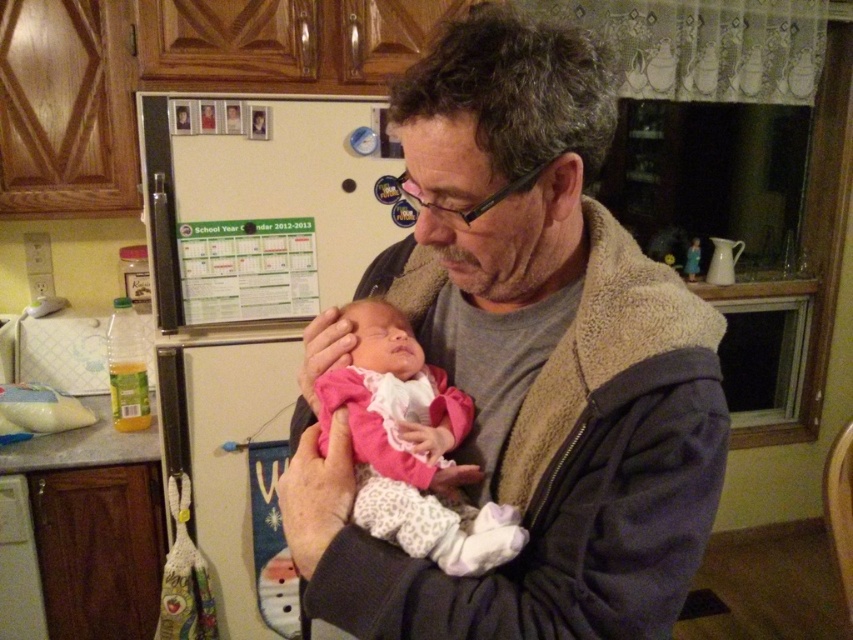
Is point (650, 547) behind point (463, 468)?

That is False.

Who is lower down, gray fleece jacket at center or pink fleece baby at center?

pink fleece baby at center is below.

Find the location of a particular element. This screenshot has height=640, width=853. gray fleece jacket at center is located at coordinates (524, 364).